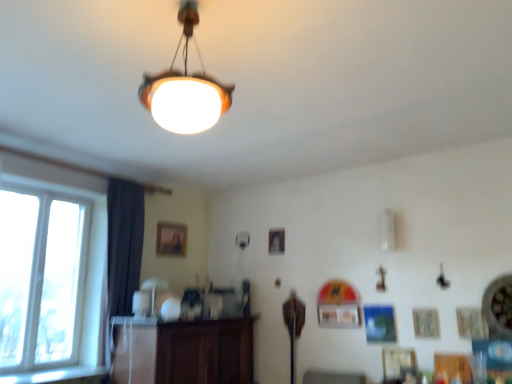
Question: From a real-world perspective, is brown wooden dresser at center located beneath matte white lampshade at center, the first lamp viewed from the back?

Choices:
 (A) no
 (B) yes

Answer: (B)

Question: Considering the relative sizes of brown wooden dresser at center and matte white lampshade at center, which is counted as the 1th lamp, starting from the left, in the image provided, is brown wooden dresser at center thinner than matte white lampshade at center, which is counted as the 1th lamp, starting from the left,?

Choices:
 (A) no
 (B) yes

Answer: (A)

Question: From the image's perspective, does brown wooden dresser at center appear lower than matte white lampshade at center, arranged as the 2th lamp when viewed from the right?

Choices:
 (A) no
 (B) yes

Answer: (B)

Question: Is brown wooden dresser at center at the left side of matte white lampshade at center, which is counted as the 1th lamp, starting from the left?

Choices:
 (A) yes
 (B) no

Answer: (B)

Question: Is brown wooden dresser at center completely or partially outside of matte white lampshade at center, which is counted as the 2th lamp, starting from the top?

Choices:
 (A) yes
 (B) no

Answer: (A)

Question: From a real-world perspective, relative to wooden frame at center, is white glass window at left vertically above or below?

Choices:
 (A) below
 (B) above

Answer: (A)

Question: From the image's perspective, relative to wooden frame at center, is white glass window at left above or below?

Choices:
 (A) above
 (B) below

Answer: (B)

Question: Looking at the image, does white glass window at left seem bigger or smaller compared to wooden frame at center?

Choices:
 (A) small
 (B) big

Answer: (B)

Question: Is white glass window at left in front of or behind wooden frame at center in the image?

Choices:
 (A) behind
 (B) front

Answer: (B)

Question: Is matte glass lampshade at upper center, which ranks as the 1th lamp in front-to-back order, wider or thinner than brown wooden dresser at center?

Choices:
 (A) thin
 (B) wide

Answer: (A)

Question: From a real-world perspective, is matte glass lampshade at upper center, which appears as the first lamp when viewed from the top, physically located above or below brown wooden dresser at center?

Choices:
 (A) above
 (B) below

Answer: (A)

Question: Is point (166, 110) closer or farther from the camera than point (165, 369)?

Choices:
 (A) closer
 (B) farther

Answer: (A)

Question: Considering the relative positions of matte glass lampshade at upper center, the second lamp in the back-to-front sequence, and brown wooden dresser at center in the image provided, is matte glass lampshade at upper center, the second lamp in the back-to-front sequence, to the left or to the right of brown wooden dresser at center?

Choices:
 (A) right
 (B) left

Answer: (A)

Question: Is matte white lampshade at center, the first lamp viewed from the back, bigger or smaller than white glass window at left?

Choices:
 (A) small
 (B) big

Answer: (A)

Question: Visually, is matte white lampshade at center, the first lamp from the bottom, positioned to the left or to the right of white glass window at left?

Choices:
 (A) right
 (B) left

Answer: (A)